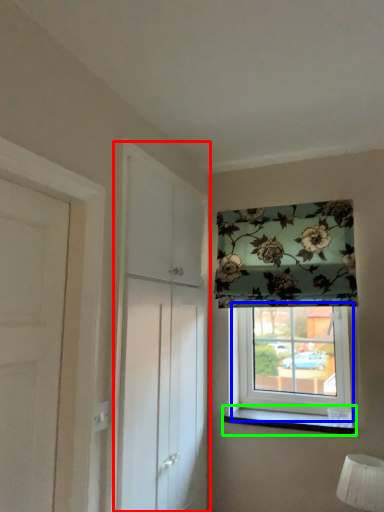
Question: Which object is the farthest from screen door (highlighted by a red box)? Choose among these: window (highlighted by a blue box) or window sill (highlighted by a green box).

Choices:
 (A) window
 (B) window sill

Answer: (B)